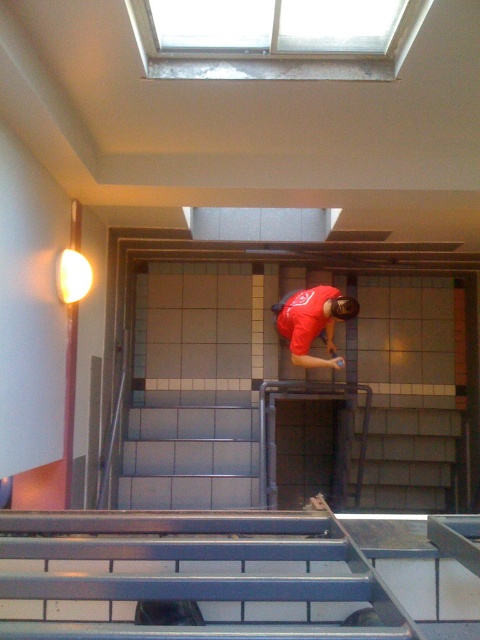
You are a painter holding a 1.2 meter wide painting that you want to display on the wall. You see the metallic gray stairs at center and the matte red shirt at center in the image. Which object is wider, and can you fit your painting between them?

The metallic gray stairs at center might be wider than matte red shirt at center. Since the painting is 1.2 meters wide, you should check the width of both objects. If the stairs are wider, place the painting next to the narrower shirt. If the shirt is wider, adjust accordingly. However, without exact measurements, it is uncertain.

You are standing at the bottom of the staircase in the image and want to reach the skylight at the top. There are two points marked on the wall tiles. Can you determine which point, point (214,401) or point (357,304), is closer to the skylight?

Point (214,401) is behind point (357,304), so it is further away from the skylight. Therefore, point (357,304) is closer to the skylight.

You are standing at the bottom of the staircase and see the metallic gray stairs at center and the matte red shirt at center. Which object is closer to you?

The metallic gray stairs at center are closer to you than the matte red shirt at center.